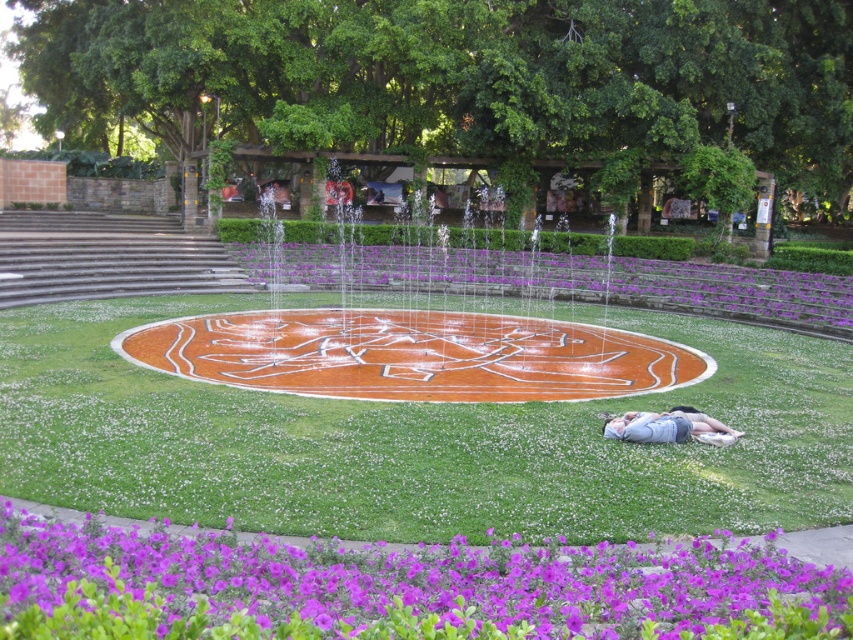
Question: Which object appears farthest from the camera in this image?

Choices:
 (A) light blue denim shorts at lower right
 (B) purple glossy flowers at center
 (C) orange polished stone fountain at center
 (D) purple matte flower at lower left

Answer: (B)

Question: Which is farther from the light blue denim shorts at lower right?

Choices:
 (A) purple matte flower at lower left
 (B) orange polished stone fountain at center
 (C) purple glossy flowers at center

Answer: (C)

Question: Is green grass at center below orange polished stone fountain at center?

Choices:
 (A) no
 (B) yes

Answer: (B)

Question: Can you confirm if green grass at center is bigger than light blue denim shorts at lower right?

Choices:
 (A) no
 (B) yes

Answer: (B)

Question: Is orange polished stone fountain at center above purple glossy flowers at center?

Choices:
 (A) yes
 (B) no

Answer: (B)

Question: Which point is farther to the camera?

Choices:
 (A) orange polished stone fountain at center
 (B) green grass at center
 (C) purple glossy flowers at center

Answer: (C)